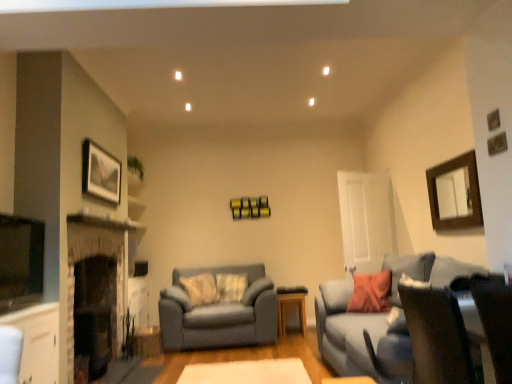
Question: Considering the relative positions of matte gray couch at center, the 1th studio couch when ordered from left to right, and white felt rug at center in the image provided, is matte gray couch at center, the 1th studio couch when ordered from left to right, behind white felt rug at center?

Choices:
 (A) no
 (B) yes

Answer: (B)

Question: Can you confirm if matte gray couch at center, the 1th studio couch when ordered from left to right, is smaller than white felt rug at center?

Choices:
 (A) no
 (B) yes

Answer: (A)

Question: Does matte gray couch at center, the second studio couch positioned from the front, have a lesser height compared to white felt rug at center?

Choices:
 (A) yes
 (B) no

Answer: (B)

Question: From a real-world perspective, is matte gray couch at center, the 1th studio couch when ordered from left to right, beneath white felt rug at center?

Choices:
 (A) no
 (B) yes

Answer: (A)

Question: Does matte gray couch at center, the second studio couch in the right-to-left sequence, have a lesser width compared to white felt rug at center?

Choices:
 (A) yes
 (B) no

Answer: (A)

Question: Does matte gray couch at center, placed as the first studio couch when sorted from back to front, have a larger size compared to white felt rug at center?

Choices:
 (A) yes
 (B) no

Answer: (A)

Question: From the image's perspective, is light brown wooden table at center below dark stone fireplace at left?

Choices:
 (A) no
 (B) yes

Answer: (B)

Question: Does light brown wooden table at center appear on the left side of dark stone fireplace at left?

Choices:
 (A) yes
 (B) no

Answer: (B)

Question: Is light brown wooden table at center oriented towards dark stone fireplace at left?

Choices:
 (A) yes
 (B) no

Answer: (B)

Question: Does light brown wooden table at center lie in front of dark stone fireplace at left?

Choices:
 (A) yes
 (B) no

Answer: (B)

Question: From a real-world perspective, is light brown wooden table at center under dark stone fireplace at left?

Choices:
 (A) yes
 (B) no

Answer: (A)

Question: From a real-world perspective, is light brown wooden table at center on top of dark stone fireplace at left?

Choices:
 (A) yes
 (B) no

Answer: (B)

Question: Considering the relative positions of wooden mirror at upper right, the second picture frame positioned from the left, and matte gray couch at right, arranged as the second studio couch when viewed from the back, in the image provided, is wooden mirror at upper right, the second picture frame positioned from the left, to the right of matte gray couch at right, arranged as the second studio couch when viewed from the back, from the viewer's perspective?

Choices:
 (A) yes
 (B) no

Answer: (A)